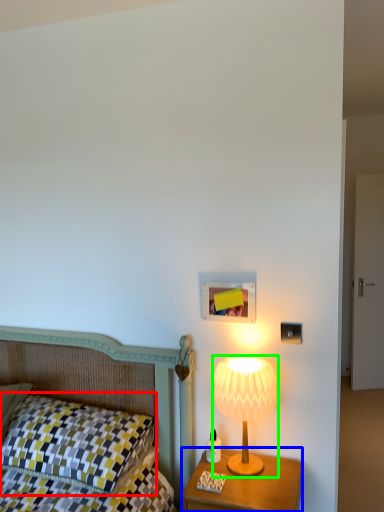
Question: Considering the real-world distances, which object is closest to pillow (highlighted by a red box)? nightstand (highlighted by a blue box) or lamp (highlighted by a green box).

Choices:
 (A) nightstand
 (B) lamp

Answer: (A)